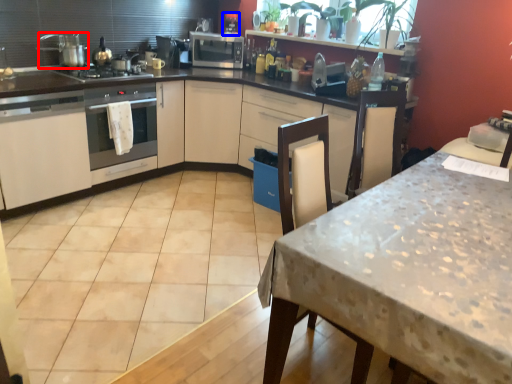
Question: Which point is closer to the camera, kitchen appliance (highlighted by a red box) or coffee machine (highlighted by a blue box)?

Choices:
 (A) kitchen appliance
 (B) coffee machine

Answer: (A)